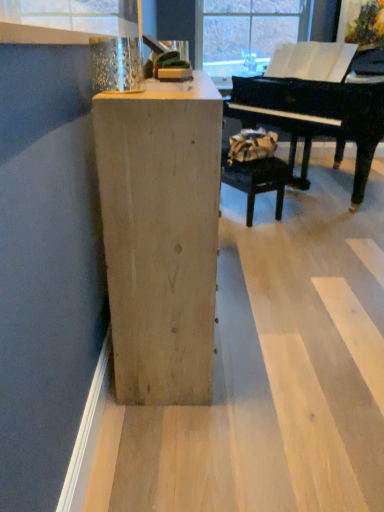
Identify the location of vacant area that lies to the right of natural wood cabinet at center. Image resolution: width=384 pixels, height=512 pixels. (296, 301).